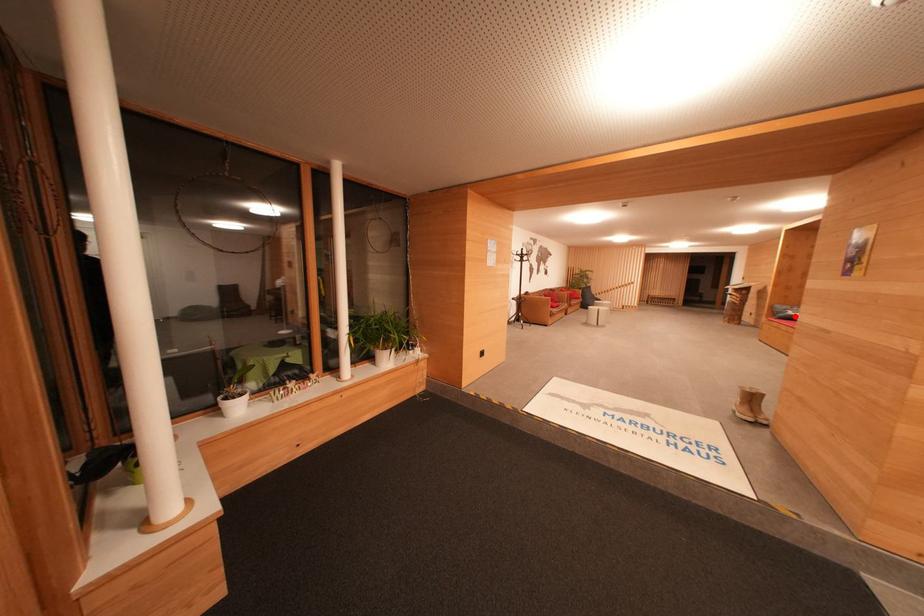
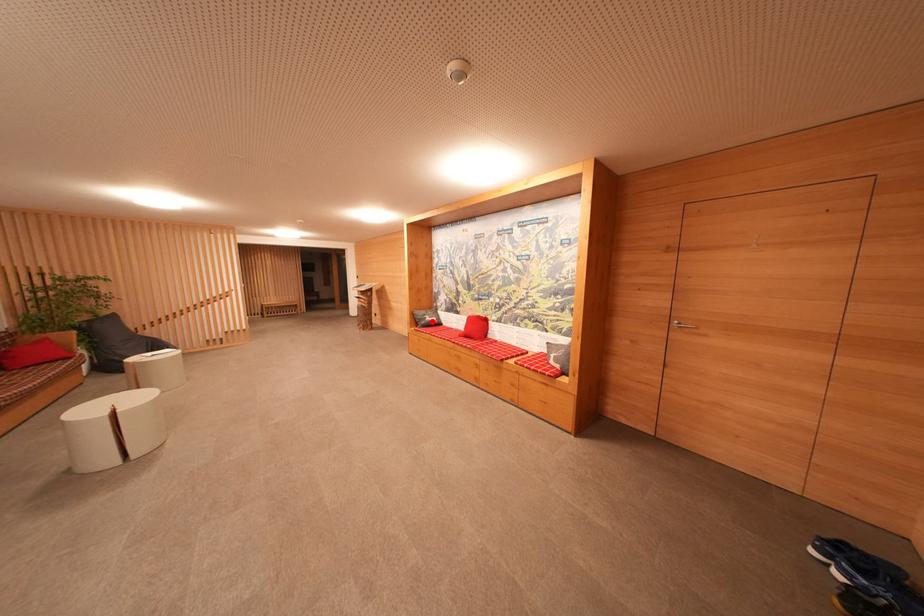
I am providing you with two images of the same scene from different viewpoints. A red point is marked on the first image and another point is marked on the second image. Are the points marked in image1 and image2 representing the same 3D position?

Yes